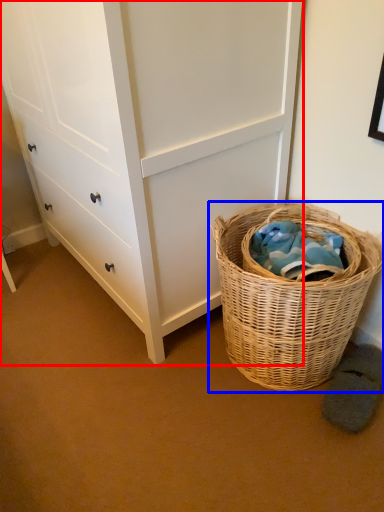
Question: Which point is further to the camera, chest of drawers (highlighted by a red box) or picnic basket (highlighted by a blue box)?

Choices:
 (A) chest of drawers
 (B) picnic basket

Answer: (B)